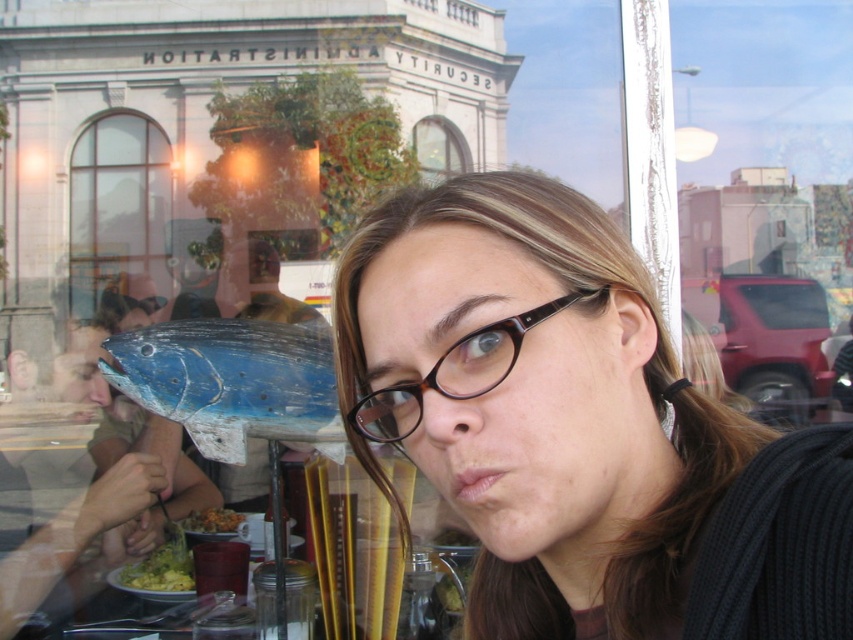
Looking at this image, you are standing in front of the window in the restaurant and see the blue wooden fish at center. Can you determine its exact position using the coordinate system provided?

The blue wooden fish at center is located at point (233, 381).

Based on the photo, you are a customer sitting at a table in the restaurant. You want to see both the clear glass window at upper left and the green leafy salad at lower left. Which object should you look towards first to see both?

You should look towards the clear glass window at upper left first because it is to the left of the green leafy salad at lower left, so by starting there and moving your gaze to the right, you can see both objects.

You are a customer in a restaurant and see the blue wooden fish at center and the green leafy salad at lower left on your table. Which item is placed above the other?

The blue wooden fish at center is positioned over the green leafy salad at lower left.